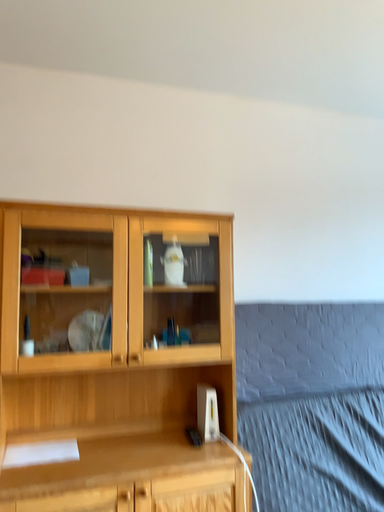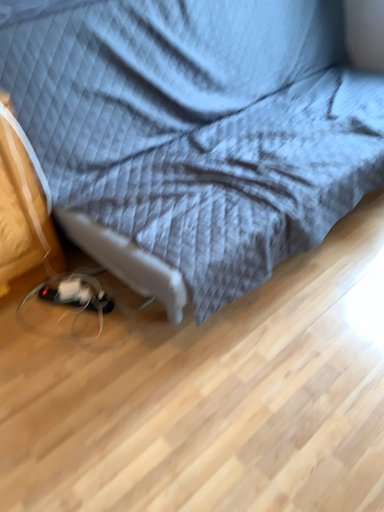
Question: Which way did the camera rotate in the video?

Choices:
 (A) rotated downward
 (B) rotated upward

Answer: (A)